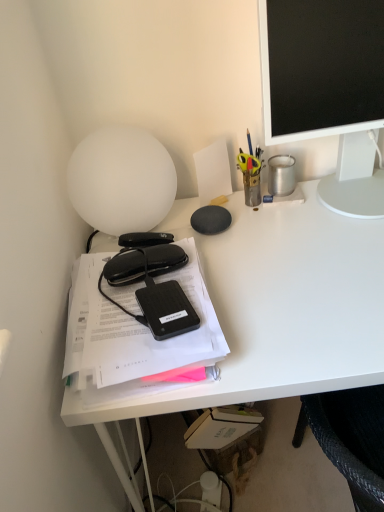
This screenshot has height=512, width=384. What are the coordinates of `spots to the right of black matte hardcover at left` in the screenshot? It's located at (282, 285).